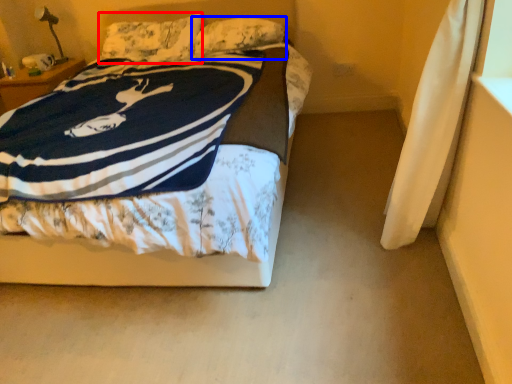
Question: Which of the following is the closest to the observer, pillow (highlighted by a red box) or pillow (highlighted by a blue box)?

Choices:
 (A) pillow
 (B) pillow

Answer: (B)